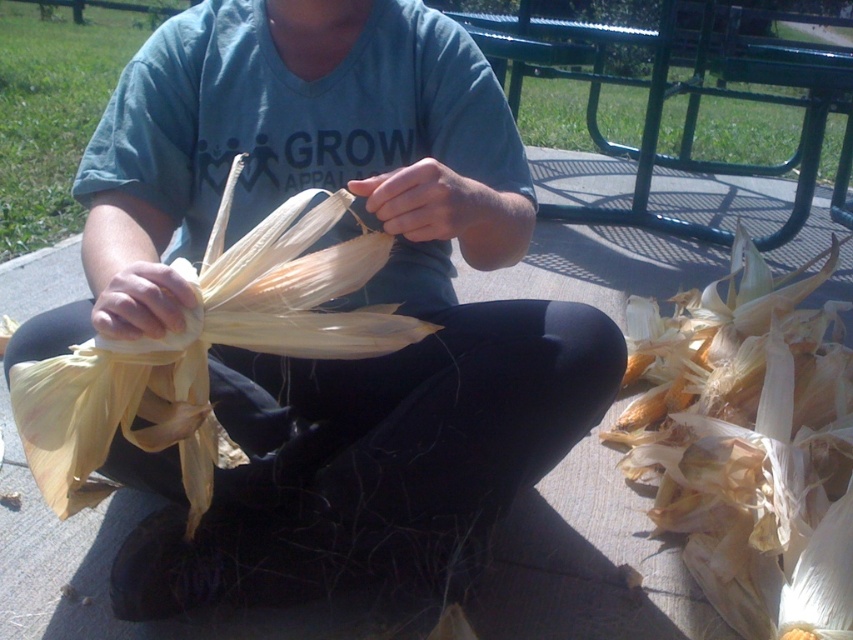
Can you confirm if matte yellow corn husk at center is wider than yellow papery corn husks at lower right?

Indeed, matte yellow corn husk at center has a greater width compared to yellow papery corn husks at lower right.

Measure the distance between matte yellow corn husk at center and yellow papery corn husks at lower right.

21.73 inches

The width and height of the screenshot is (853, 640). I want to click on matte yellow corn husk at center, so click(338, 307).

Who is shorter, matte yellow corn husk at center or yellow papery corn at center?

Standing shorter between the two is yellow papery corn at center.

Does matte yellow corn husk at center lie behind yellow papery corn at center?

No, matte yellow corn husk at center is closer to the viewer.

In order to click on matte yellow corn husk at center in this screenshot , I will do `click(338, 307)`.

Can you confirm if yellow papery corn husks at lower right is positioned above yellow papery corn at center?

No, yellow papery corn husks at lower right is not above yellow papery corn at center.

Does point (798, 596) come closer to viewer compared to point (218, 224)?

That is False.

Who is more distant from viewer, (846, 451) or (271, 259)?

The point (846, 451) is more distant.

The image size is (853, 640). I want to click on yellow papery corn husks at lower right, so [749, 444].